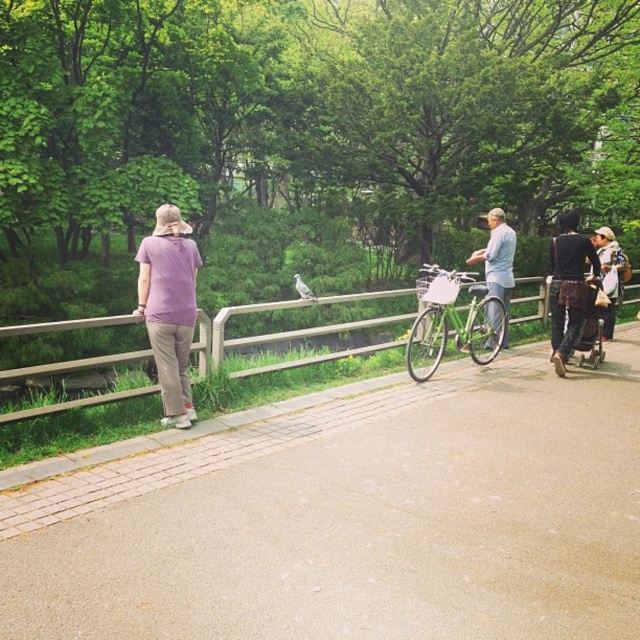
Question: Can you confirm if concrete pavement at center is wider than light blue fabric shirt at center?

Choices:
 (A) yes
 (B) no

Answer: (A)

Question: Among these objects, which one is farthest from the camera?

Choices:
 (A) green matte bicycle at center
 (B) light blue fabric shirt at center
 (C) purple cotton shirt at left
 (D) concrete pavement at center

Answer: (B)

Question: Is wooden fence at left smaller than dark brown leather jacket at right?

Choices:
 (A) no
 (B) yes

Answer: (A)

Question: Estimate the real-world distances between objects in this image. Which object is closer to the concrete pavement at center?

Choices:
 (A) wooden fence at left
 (B) light blue fabric shirt at center
 (C) purple cotton shirt at left
 (D) green matte bicycle at center

Answer: (C)

Question: Which point is closer to the camera taking this photo?

Choices:
 (A) (609, 440)
 (B) (422, 285)
 (C) (556, 250)
 (D) (531, 276)

Answer: (A)

Question: Is concrete pavement at center below green matte bicycle at center?

Choices:
 (A) no
 (B) yes

Answer: (B)